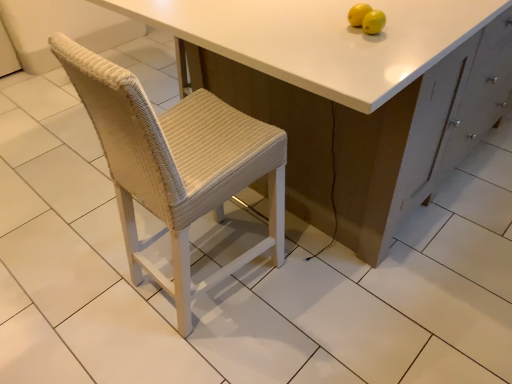
The height and width of the screenshot is (384, 512). In order to click on vacant area situated to the left side of yellow matte lemons at upper right in this screenshot , I will do point(311,42).